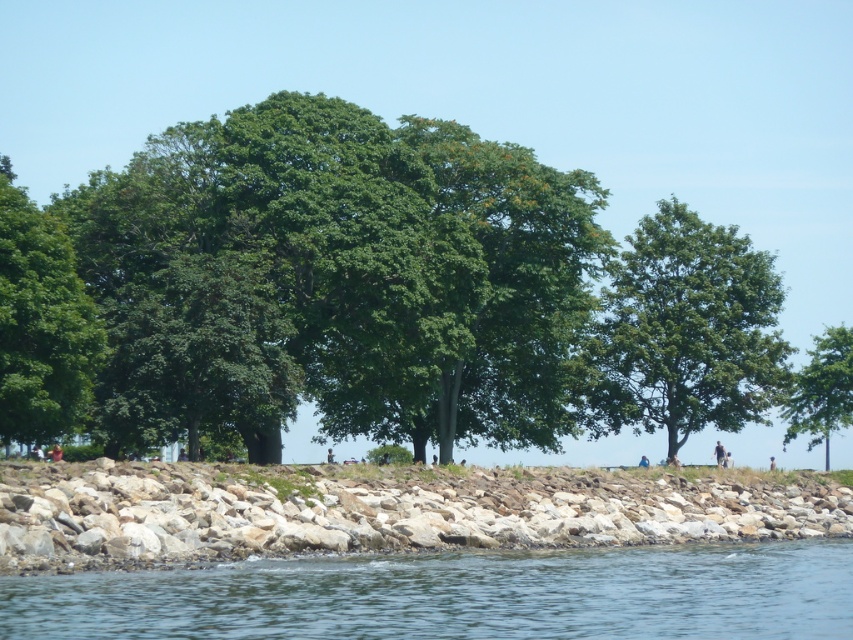
Is point (750, 300) closer to camera compared to point (798, 433)?

Yes, point (750, 300) is in front of point (798, 433).

Who is lower down, green leafy tree at center or green leafy tree at right?

green leafy tree at right

This screenshot has width=853, height=640. Describe the element at coordinates (686, 332) in the screenshot. I see `green leafy tree at center` at that location.

I want to click on green leafy tree at center, so click(x=686, y=332).

Does gray/rocky stone at lower center appear on the right side of green leafy tree at left?

Yes, gray/rocky stone at lower center is to the right of green leafy tree at left.

Does point (361, 486) come behind point (18, 369)?

No.

Find the location of `gray/rocky stone at lower center`. gray/rocky stone at lower center is located at coordinates (380, 509).

You are a GUI agent. You are given a task and a screenshot of the screen. Output one action in this format:
    pyautogui.click(x=<x>, y=<y>)
    Task: Click on the gray/rocky stone at lower center
    
    Given the screenshot: What is the action you would take?
    pyautogui.click(x=380, y=509)

Does gray/rocky stone at lower center have a greater height compared to green leafy tree at right?

No, gray/rocky stone at lower center is not taller than green leafy tree at right.

Is point (334, 516) farther from viewer compared to point (786, 428)?

No, (334, 516) is in front of (786, 428).

Is point (494, 513) farther from viewer compared to point (834, 406)?

No, it is in front of (834, 406).

Locate an element on the screen. gray/rocky stone at lower center is located at coordinates (380, 509).